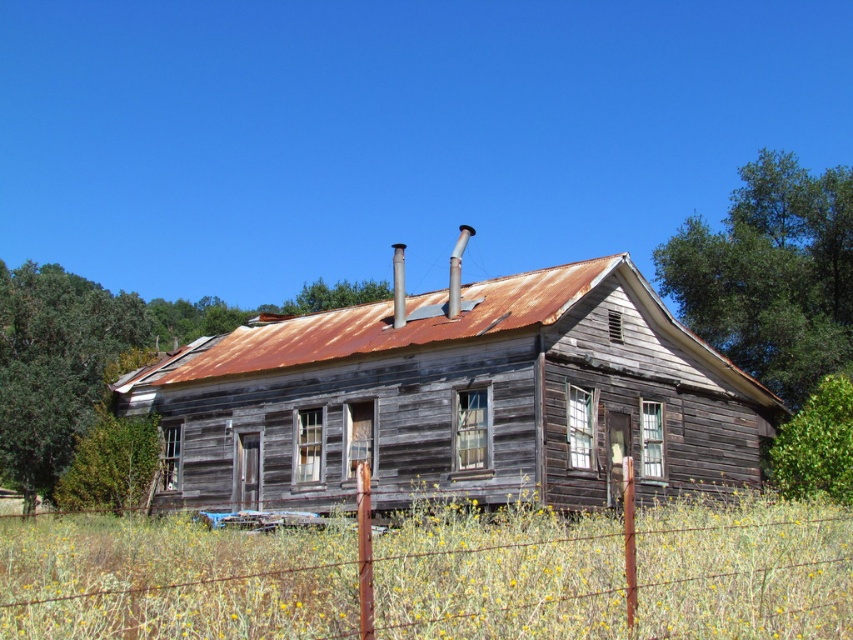
You are a bird looking for a nesting spot. You see a weathered wood tree at center and a green leafy tree at upper right. Which tree would you choose if you want to build your nest higher up?

The green leafy tree at upper right is taller than the weathered wood tree at center, so you should choose the green leafy tree at upper right to build your nest higher up.

In the scene shown: You are standing in front of the old wooden house and notice two trees nearby. The weathered wood tree at center and the green leafy tree at left. Which tree is larger in size?

The weathered wood tree at center is bigger than the green leafy tree at left according to the description.

You are standing in front of the old wooden house and notice two trees. The weathered wood tree at center and the green leafy tree at upper right. Which tree is positioned to the left of the other?

The weathered wood tree at center is positioned to the left of the green leafy tree at upper right.